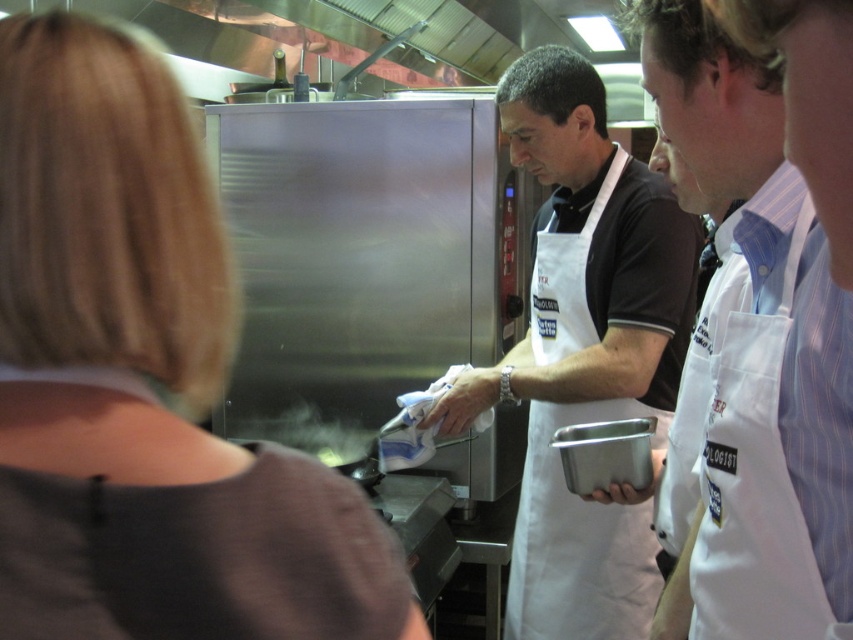
Based on the photo, you are a new chef entering the kitchen and need to choose an apron. There are two white aprons available. One is labeled as the white apron at right and the other as the white apron at center. Which apron should you choose if you prefer a smaller size?

The white apron at right is smaller than the white apron at center, so you should choose the white apron at right if you prefer a smaller size.

You are a new employee in the kitchen and need to identify the clothing items. Which clothing item is smaller in size between the brown matte shirt at upper left and the white apron at center?

The brown matte shirt at upper left is smaller than the white apron at center according to the description.

You are a chef in this kitchen and need to determine which clothing item is narrower between the brown matte shirt at upper left and the white fabric apron at center. Which one is narrower?

The brown matte shirt at upper left is narrower than the white fabric apron at center.